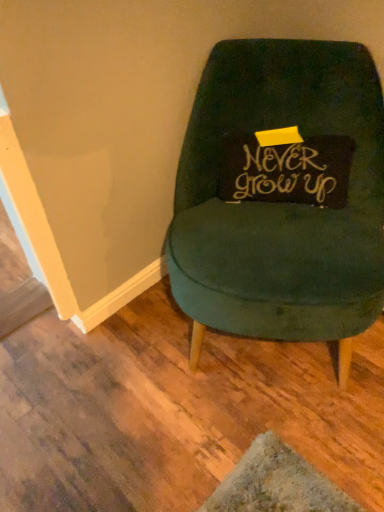
Identify the location of vacant area that is in front of velvet green chair at center. This screenshot has width=384, height=512. (255, 440).